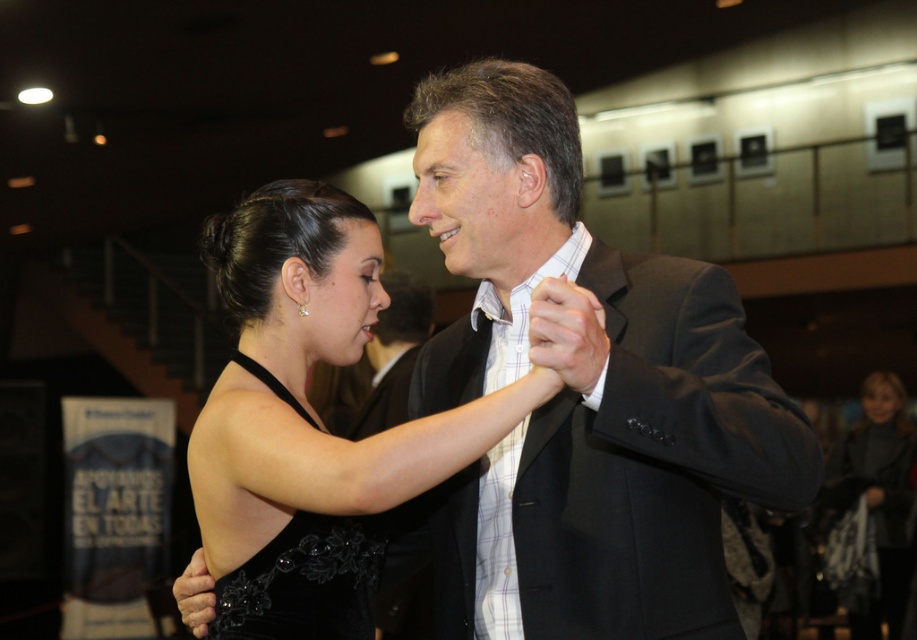
Question: Which object is closer to the camera taking this photo?

Choices:
 (A) white checkered dress shirt at center
 (B) black satin dress at center
 (C) black velvet dress at center

Answer: (B)

Question: In this image, where is black satin dress at center located relative to white checkered dress shirt at center?

Choices:
 (A) above
 (B) below

Answer: (A)

Question: Which point appears farthest from the camera in this image?

Choices:
 (A) (906, 556)
 (B) (335, 545)
 (C) (569, 157)

Answer: (A)

Question: Can you confirm if white checkered dress shirt at center is wider than black velvet dress at lower right?

Choices:
 (A) yes
 (B) no

Answer: (B)

Question: Which point appears farthest from the camera in this image?

Choices:
 (A) (566, 627)
 (B) (846, 477)

Answer: (B)

Question: Is white checkered dress shirt at center to the right of black velvet dress at lower right from the viewer's perspective?

Choices:
 (A) no
 (B) yes

Answer: (A)